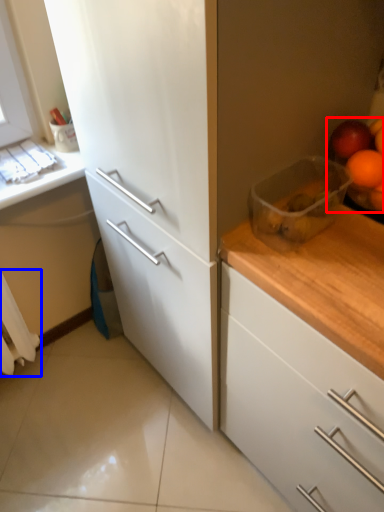
Question: Which object appears farthest to the camera in this image, fruit (highlighted by a red box) or curtain (highlighted by a blue box)?

Choices:
 (A) fruit
 (B) curtain

Answer: (B)